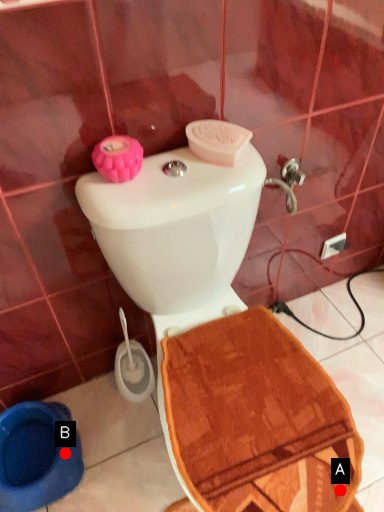
Question: Two points are circled on the image, labeled by A and B beside each circle. Among these points, which one is farthest from the camera?

Choices:
 (A) A is further
 (B) B is further

Answer: (B)